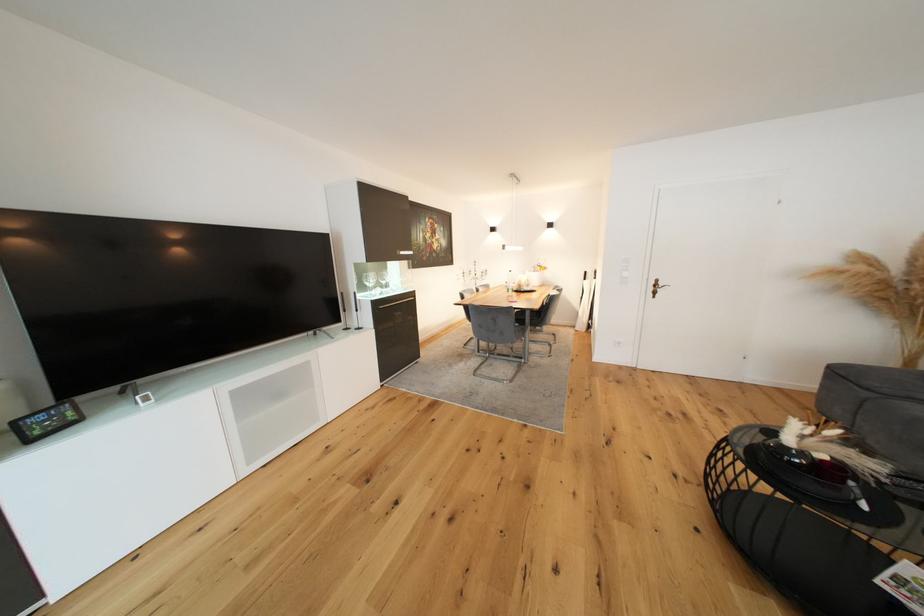
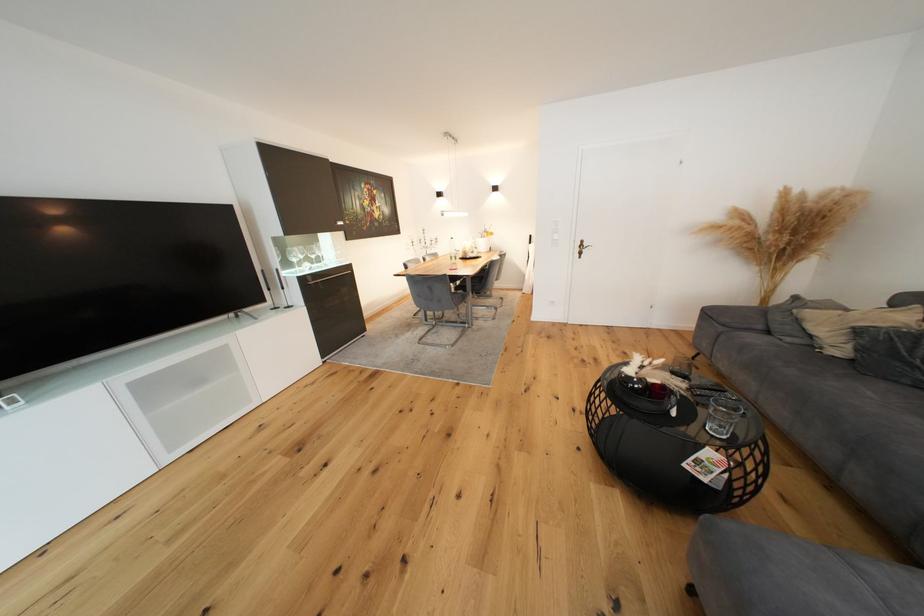
The point at (538, 281) is marked in the first image. Where is the corresponding point in the second image?

(489, 246)